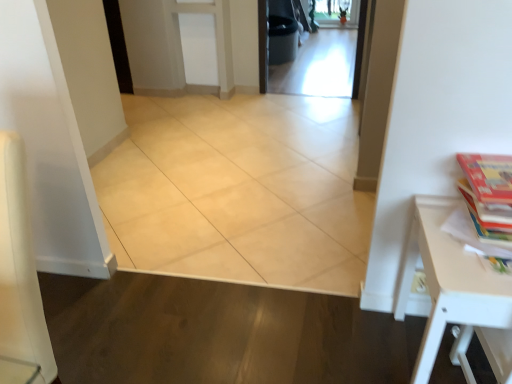
Question: Is the position of transparent glass screen door at center less distant than that of beige ceramic tile at center?

Choices:
 (A) yes
 (B) no

Answer: (B)

Question: Is transparent glass screen door at center placed right next to beige ceramic tile at center?

Choices:
 (A) no
 (B) yes

Answer: (A)

Question: Is transparent glass screen door at center facing towards beige ceramic tile at center?

Choices:
 (A) yes
 (B) no

Answer: (A)

Question: Considering the relative sizes of transparent glass screen door at center and beige ceramic tile at center in the image provided, is transparent glass screen door at center wider than beige ceramic tile at center?

Choices:
 (A) no
 (B) yes

Answer: (B)

Question: From a real-world perspective, is transparent glass screen door at center located beneath beige ceramic tile at center?

Choices:
 (A) no
 (B) yes

Answer: (B)

Question: Could beige ceramic tile at center be considered to be inside transparent glass screen door at center?

Choices:
 (A) no
 (B) yes

Answer: (A)

Question: Can you confirm if white matte table at right is positioned to the left of multicolored paper book at right?

Choices:
 (A) yes
 (B) no

Answer: (A)

Question: Would you consider white matte table at right to be distant from multicolored paper book at right?

Choices:
 (A) no
 (B) yes

Answer: (A)

Question: Is white matte table at right facing away from multicolored paper book at right?

Choices:
 (A) yes
 (B) no

Answer: (B)

Question: From a real-world perspective, is white matte table at right located higher than multicolored paper book at right?

Choices:
 (A) yes
 (B) no

Answer: (B)

Question: Is white matte table at right wider than multicolored paper book at right?

Choices:
 (A) no
 (B) yes

Answer: (B)

Question: Is white matte table at right at the right side of multicolored paper book at right?

Choices:
 (A) yes
 (B) no

Answer: (B)

Question: Is multicolored paper book at right thinner than transparent glass screen door at center?

Choices:
 (A) yes
 (B) no

Answer: (A)